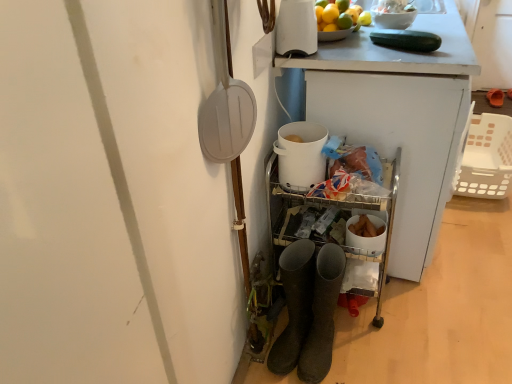
You are a GUI agent. You are given a task and a screenshot of the screen. Output one action in this format:
    pyautogui.click(x=<x>, y=<y>)
    Task: Click on the free space to the left of dark brown suede boots at lower center, which appears as the 2th footwear when viewed from the right
    
    Given the screenshot: What is the action you would take?
    pyautogui.click(x=272, y=366)